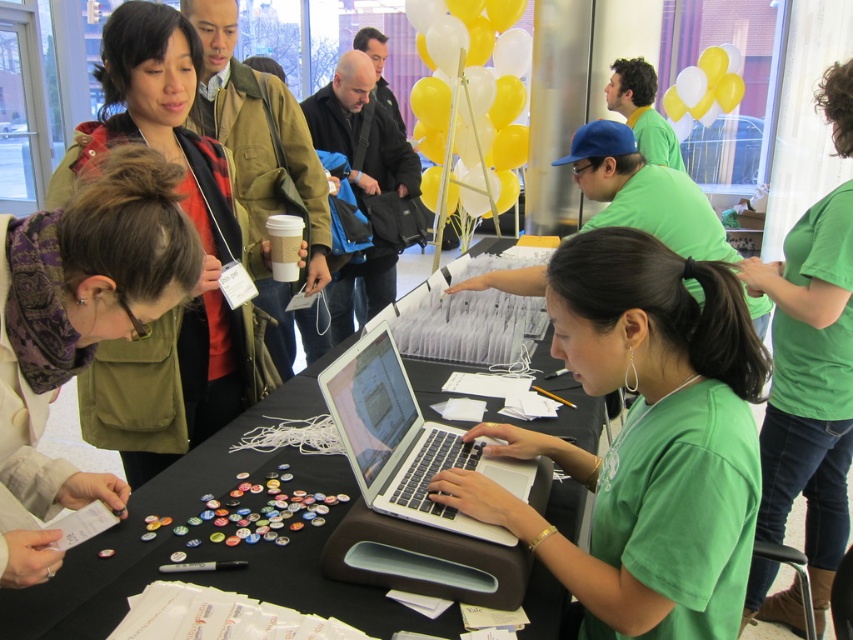
Question: Which point is closer to the camera taking this photo?

Choices:
 (A) (135, 387)
 (B) (427, 628)
 (C) (733, 72)
 (D) (395, 506)

Answer: (B)

Question: Is black fabric table at center behind yellow matte balloons at upper center?

Choices:
 (A) yes
 (B) no

Answer: (B)

Question: Is green matte shirt at center below yellow matte balloons at upper center?

Choices:
 (A) no
 (B) yes

Answer: (B)

Question: Based on their relative distances, which object is nearer to the olive green jacket at upper left?

Choices:
 (A) yellow matte balloons at upper right
 (B) green matte shirt at center
 (C) black fabric table at center

Answer: (C)

Question: Which point is farther from the camera taking this photo?

Choices:
 (A) (483, 17)
 (B) (817, 88)
 (C) (683, 550)

Answer: (A)

Question: Does black fabric table at center lie in front of silver metallic laptop at center?

Choices:
 (A) no
 (B) yes

Answer: (B)